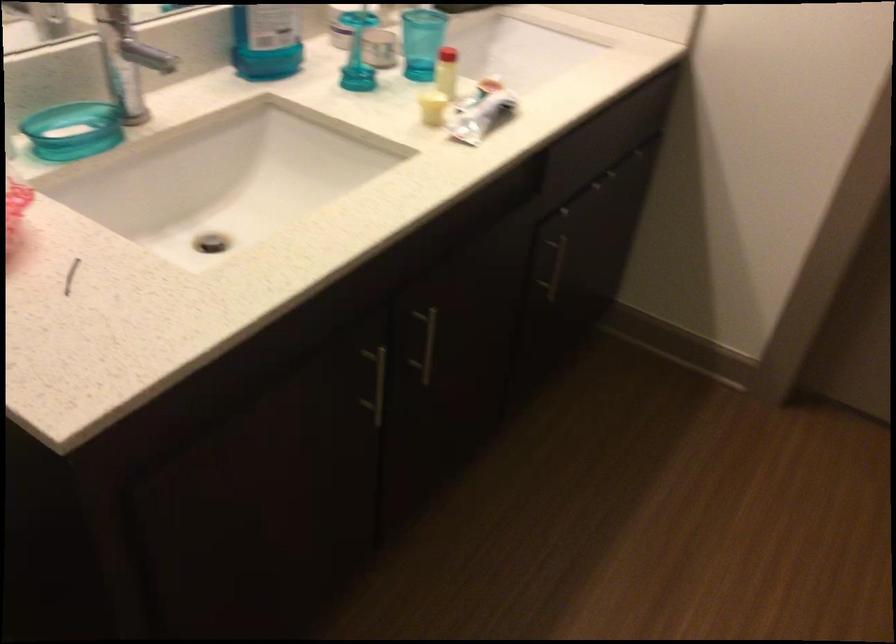
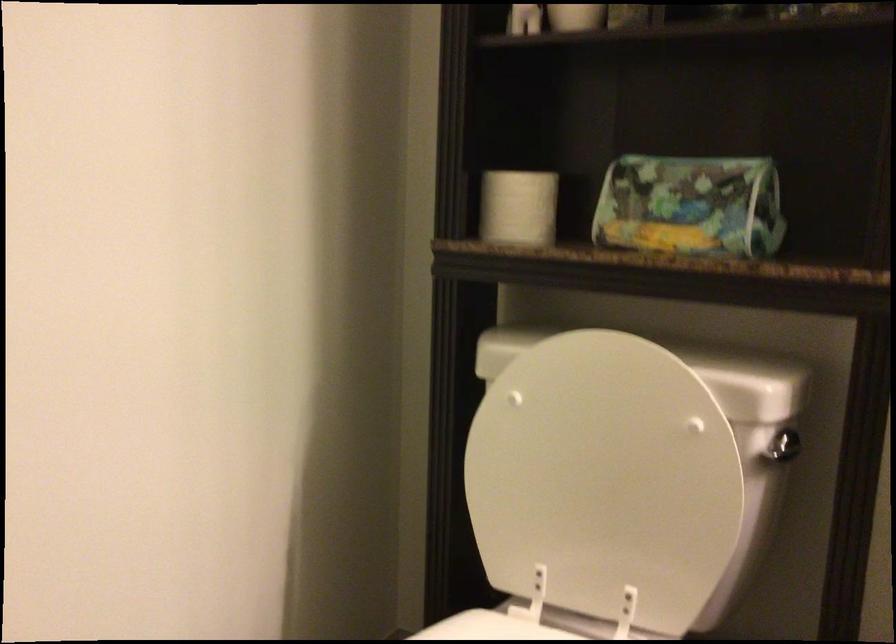
Question: Based on the continuous images, in which direction is the camera rotating? Reply with the corresponding letter.

Choices:
 (A) Left
 (B) Right
 (C) Up
 (D) Down

Answer: (A)